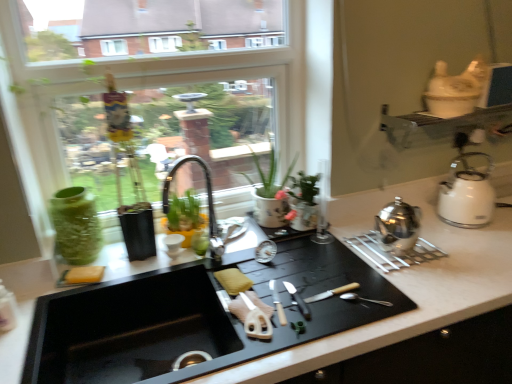
The image size is (512, 384). In order to click on free space in front of white glossy kettle at right, the first kitchen appliance when ordered from back to front in this screenshot , I will do `click(479, 243)`.